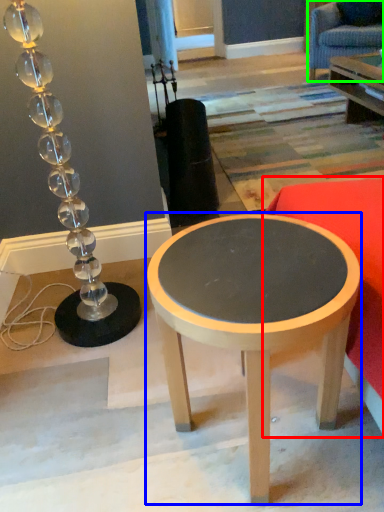
Question: Considering the real-world distances, which object is closest to studio couch (highlighted by a red box)? coffee table (highlighted by a blue box) or swivel chair (highlighted by a green box).

Choices:
 (A) coffee table
 (B) swivel chair

Answer: (A)